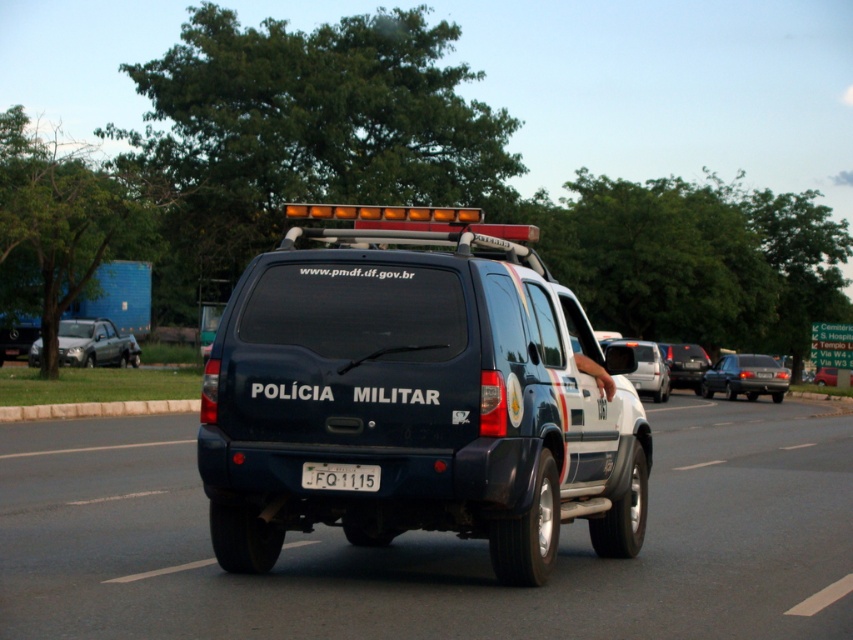
Between silver metallic hatchback at left and matte black suv at center, which one appears on the left side from the viewer's perspective?

silver metallic hatchback at left is more to the left.

Between silver metallic hatchback at left and matte black suv at center, which one is positioned higher?

silver metallic hatchback at left is above.

Based on the photo, who is more forward, (80, 321) or (669, 387)?

Point (669, 387) is in front.

Where is `silver metallic hatchback at left`? silver metallic hatchback at left is located at coordinates (96, 342).

Does metallic gray sedan at center come behind white glossy suv at center?

Yes, metallic gray sedan at center is further from the viewer.

Does metallic gray sedan at center have a greater height compared to white glossy suv at center?

No.

What do you see at coordinates (746, 376) in the screenshot?
I see `metallic gray sedan at center` at bounding box center [746, 376].

Locate an element on the screen. Image resolution: width=853 pixels, height=640 pixels. metallic gray sedan at center is located at coordinates (746, 376).

Is silver metallic hatchback at left to the left of metallic blue suv at center from the viewer's perspective?

Correct, you'll find silver metallic hatchback at left to the left of metallic blue suv at center.

Who is more distant from viewer, (61, 336) or (851, 372)?

The point (851, 372) is more distant.

This screenshot has width=853, height=640. In order to click on silver metallic hatchback at left in this screenshot , I will do `click(96, 342)`.

This screenshot has height=640, width=853. In order to click on silver metallic hatchback at left in this screenshot , I will do tap(96, 342).